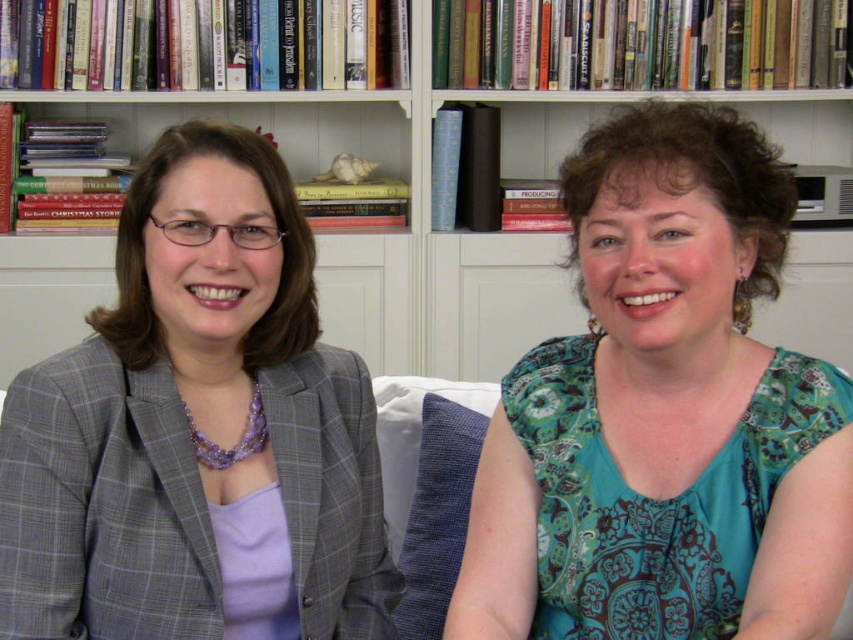
You are a photographer standing 10 feet away from the two people in the image. You want to take a photo of both of them clearly. Given that your camera has a maximum focus range of 35 inches, will you be able to capture both the gray checkered blazer at left and the person on the right in focus?

The two individuals are 35.01 inches apart, which exceeds the camera maximum focus range of 35 inches. Therefore, you cannot capture both the gray checkered blazer at left and the person on the right in focus.